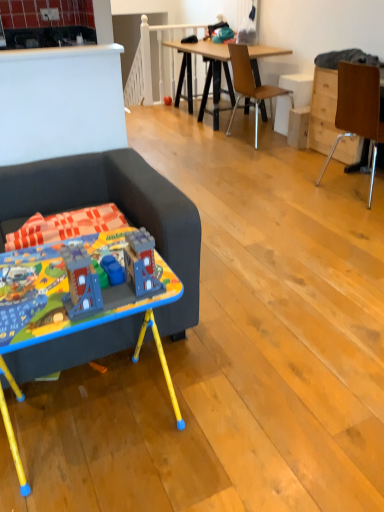
Find the location of a particular element. wooden drawer at right is located at coordinates (323, 111).

The image size is (384, 512). I want to click on dark gray fabric couch at left, so click(119, 208).

In order to click on blue plastic desk at lower left in this screenshot , I will do `click(65, 308)`.

Where is `matte plastic toy at center, which appears as the second toy when ordered from the bottom`? Image resolution: width=384 pixels, height=512 pixels. matte plastic toy at center, which appears as the second toy when ordered from the bottom is located at coordinates (167, 100).

Where is `wooden drawer at right`? This screenshot has width=384, height=512. wooden drawer at right is located at coordinates (323, 111).

Is plastic toy castle at left, which appears as the 1th toy when ordered from the bottom, looking in the opposite direction of wooden chair at right, the second chair positioned from the back?

No, plastic toy castle at left, which appears as the 1th toy when ordered from the bottom, is not facing away from wooden chair at right, the second chair positioned from the back.

Starting from the plastic toy castle at left, the first toy from the front, which chair is the 2nd one to the right? Please provide its 2D coordinates.

[(358, 110)]

Is point (93, 250) behind point (369, 83)?

That is False.

Looking at this image, in terms of width, does wooden drawer at right look wider or thinner when compared to wooden chair at right, acting as the 1th chair starting from the front?

Clearly, wooden drawer at right has less width compared to wooden chair at right, acting as the 1th chair starting from the front.

Is wooden drawer at right not within wooden chair at right, the 1th chair when ordered from right to left?

Yes.

Between wooden drawer at right and wooden chair at right, which is counted as the second chair, starting from the left, which one has less height?

Standing shorter between the two is wooden drawer at right.

Between wooden drawer at right and wooden chair at right, acting as the 1th chair starting from the front, which one appears on the left side from the viewer's perspective?

wooden chair at right, acting as the 1th chair starting from the front.

Is the position of wooden chair at right, the 1th chair when ordered from right to left, less distant than that of plastic toy castle at left, the first toy from the front?

No, wooden chair at right, the 1th chair when ordered from right to left, is further to the viewer.

From the picture: From a real-world perspective, which object rests below the other?

In real-world perspective, wooden chair at right, which is counted as the second chair, starting from the left, is lower.

Is wooden chair at right, the 1th chair when ordered from right to left, facing away from plastic toy castle at left, the first toy from the front?

No, wooden chair at right, the 1th chair when ordered from right to left, is not facing the opposite direction of plastic toy castle at left, the first toy from the front.

Does blue plastic desk at lower left appear on the right side of dark gray fabric couch at left?

Indeed, blue plastic desk at lower left is positioned on the right side of dark gray fabric couch at left.

The width and height of the screenshot is (384, 512). In order to click on desk lying below the dark gray fabric couch at left (from the image's perspective) in this screenshot , I will do `click(65, 308)`.

Which is nearer, (35,332) or (193,301)?

Point (35,332)

From a real-world perspective, is blue plastic desk at lower left under dark gray fabric couch at left?

Correct, in the physical world, blue plastic desk at lower left is lower than dark gray fabric couch at left.

Does plastic toy castle at left, which appears as the 1th toy when ordered from the bottom, have a lesser width compared to matte plastic toy at center, which is the 1th toy in top-to-bottom order?

No, plastic toy castle at left, which appears as the 1th toy when ordered from the bottom, is not thinner than matte plastic toy at center, which is the 1th toy in top-to-bottom order.

Is plastic toy castle at left, which is the 2th toy in back-to-front order, to the right of matte plastic toy at center, which appears as the second toy when viewed from the front, from the viewer's perspective?

Correct, you'll find plastic toy castle at left, which is the 2th toy in back-to-front order, to the right of matte plastic toy at center, which appears as the second toy when viewed from the front.

Is plastic toy castle at left, the first toy from the front, turned away from matte plastic toy at center, which appears as the 1th toy when viewed from the back?

Yes, plastic toy castle at left, the first toy from the front,'s orientation is away from matte plastic toy at center, which appears as the 1th toy when viewed from the back.

Would you say plastic toy castle at left, the first toy from the front, is outside matte plastic toy at center, which appears as the second toy when viewed from the front?

plastic toy castle at left, the first toy from the front, lies outside matte plastic toy at center, which appears as the second toy when viewed from the front,'s area.

From a real-world perspective, which is physically above, matte plastic toy at center, which appears as the 1th toy when viewed from the back, or wooden drawer at right?

In real-world perspective, wooden drawer at right is above.

Is matte plastic toy at center, which appears as the 1th toy when viewed from the back, next to wooden drawer at right?

No, matte plastic toy at center, which appears as the 1th toy when viewed from the back, is not making contact with wooden drawer at right.

Where is `drawer on the right side of matte plastic toy at center, which is the 1th toy in top-to-bottom order`? This screenshot has height=512, width=384. drawer on the right side of matte plastic toy at center, which is the 1th toy in top-to-bottom order is located at coordinates (323, 111).

Consider the image. Is wooden drawer at right inside matte plastic toy at center, which appears as the second toy when viewed from the front?

No, wooden drawer at right is not surrounded by matte plastic toy at center, which appears as the second toy when viewed from the front.

Can you tell me how much matte plastic toy at center, which appears as the second toy when ordered from the bottom, and dark gray fabric couch at left differ in facing direction?

matte plastic toy at center, which appears as the second toy when ordered from the bottom, and dark gray fabric couch at left are facing 0.0033 degrees away from each other.

Is matte plastic toy at center, which appears as the 1th toy when viewed from the back, facing towards dark gray fabric couch at left?

No.

Considering the points (165, 97) and (160, 183), which point is in front, point (165, 97) or point (160, 183)?

The point (160, 183) is closer.

In terms of size, does matte plastic toy at center, which is the 1th toy in top-to-bottom order, appear bigger or smaller than dark gray fabric couch at left?

Clearly, matte plastic toy at center, which is the 1th toy in top-to-bottom order, is smaller in size than dark gray fabric couch at left.

What are the coordinates of `the 1st chair above the plastic toy castle at left, which is the 2th toy in top-to-bottom order (from the image's perspective)` in the screenshot? It's located at (358, 110).

Locate an element on the screen. Image resolution: width=384 pixels, height=512 pixels. chair in front of the wooden drawer at right is located at coordinates (358, 110).

Looking at the image, which one is located closer to matte plastic toy at center, which appears as the second toy when ordered from the bottom, wooden chair at right, acting as the 1th chair starting from the front, or brown wooden chair at center, positioned as the 2th chair in front-to-back order?

brown wooden chair at center, positioned as the 2th chair in front-to-back order.

Looking at the image, which one is located closer to dark gray fabric couch at left, blue plastic desk at lower left or brown wooden chair at center, which ranks as the second chair in right-to-left order?

blue plastic desk at lower left is closer to dark gray fabric couch at left.

Which object lies further to the anchor point brown wooden chair at center, which ranks as the second chair in right-to-left order, matte plastic toy at center, which appears as the 1th toy when viewed from the back, or plastic toy castle at left, the first toy from the front?

The object further to brown wooden chair at center, which ranks as the second chair in right-to-left order, is plastic toy castle at left, the first toy from the front.

Looking at the image, which one is located closer to plastic toy castle at left, which appears as the 1th toy when ordered from the bottom, wooden chair at right, the 1th chair when ordered from right to left, or dark gray fabric couch at left?

dark gray fabric couch at left is closer to plastic toy castle at left, which appears as the 1th toy when ordered from the bottom.

Which object lies nearer to the anchor point wooden chair at right, acting as the 1th chair starting from the front, brown wooden chair at center, which is the 1th chair from back to front, or matte plastic toy at center, which appears as the 1th toy when viewed from the back?

Among the two, brown wooden chair at center, which is the 1th chair from back to front, is located nearer to wooden chair at right, acting as the 1th chair starting from the front.

From the picture: Considering their positions, is brown wooden chair at center, positioned as the 2th chair in front-to-back order, positioned further to matte plastic toy at center, which is the 1th toy in top-to-bottom order, than dark gray fabric couch at left?

dark gray fabric couch at left.

From the image, which object appears to be nearer to matte plastic toy at center, which appears as the second toy when viewed from the front, wooden drawer at right or wooden chair at right, the second chair positioned from the back?

wooden drawer at right lies closer to matte plastic toy at center, which appears as the second toy when viewed from the front, than the other object.

From the image, which object appears to be nearer to wooden chair at right, acting as the 1th chair starting from the front, brown wooden chair at center, which ranks as the second chair in right-to-left order, or dark gray fabric couch at left?

The object closer to wooden chair at right, acting as the 1th chair starting from the front, is brown wooden chair at center, which ranks as the second chair in right-to-left order.

Image resolution: width=384 pixels, height=512 pixels. I want to click on drawer between plastic toy castle at left, which appears as the 1th toy when ordered from the bottom, and brown wooden chair at center, which ranks as the second chair in right-to-left order, along the z-axis, so 323,111.

You are a GUI agent. You are given a task and a screenshot of the screen. Output one action in this format:
    pyautogui.click(x=<x>, y=<y>)
    Task: Click on the desk between dark gray fabric couch at left and wooden chair at right, the second chair positioned from the back, in the horizontal direction
    
    Given the screenshot: What is the action you would take?
    pyautogui.click(x=65, y=308)

Where is `studio couch located between blue plastic desk at lower left and wooden drawer at right in the depth direction`? studio couch located between blue plastic desk at lower left and wooden drawer at right in the depth direction is located at coordinates (119, 208).

What are the coordinates of `toy between blue plastic desk at lower left and brown wooden chair at center, acting as the first chair starting from the left, in the front-back direction` in the screenshot? It's located at (73, 289).